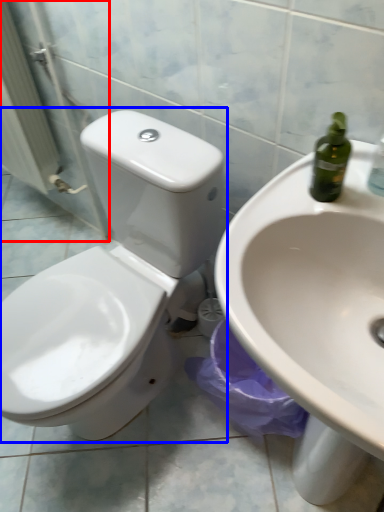
Question: Which object appears closest to the camera in this image, screen door (highlighted by a red box) or toilet (highlighted by a blue box)?

Choices:
 (A) screen door
 (B) toilet

Answer: (B)